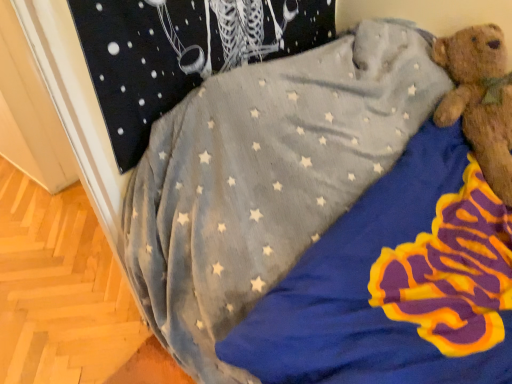
Where is `velvety blue blanket with star pattern at upper right`? Image resolution: width=512 pixels, height=384 pixels. velvety blue blanket with star pattern at upper right is located at coordinates (285, 158).

What is the approximate width of velvety blue blanket with star pattern at upper right?

velvety blue blanket with star pattern at upper right is 3.60 feet in width.

What do you see at coordinates (285, 158) in the screenshot? I see `velvety blue blanket with star pattern at upper right` at bounding box center [285, 158].

What is the approximate height of velvety blue blanket with star pattern at upper right?

velvety blue blanket with star pattern at upper right is 29.11 inches in height.

Where is `velvety blue blanket with star pattern at upper right`? The height and width of the screenshot is (384, 512). velvety blue blanket with star pattern at upper right is located at coordinates (285, 158).